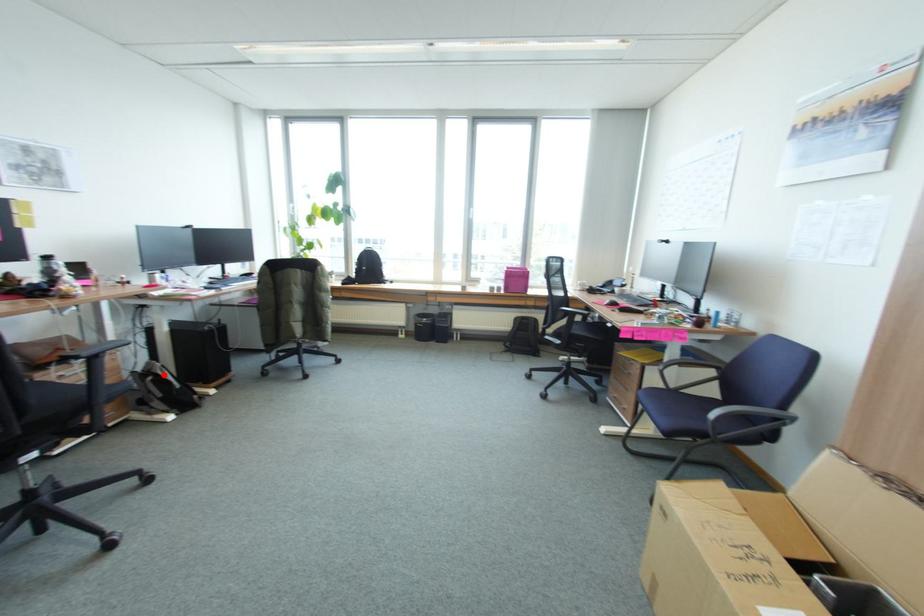
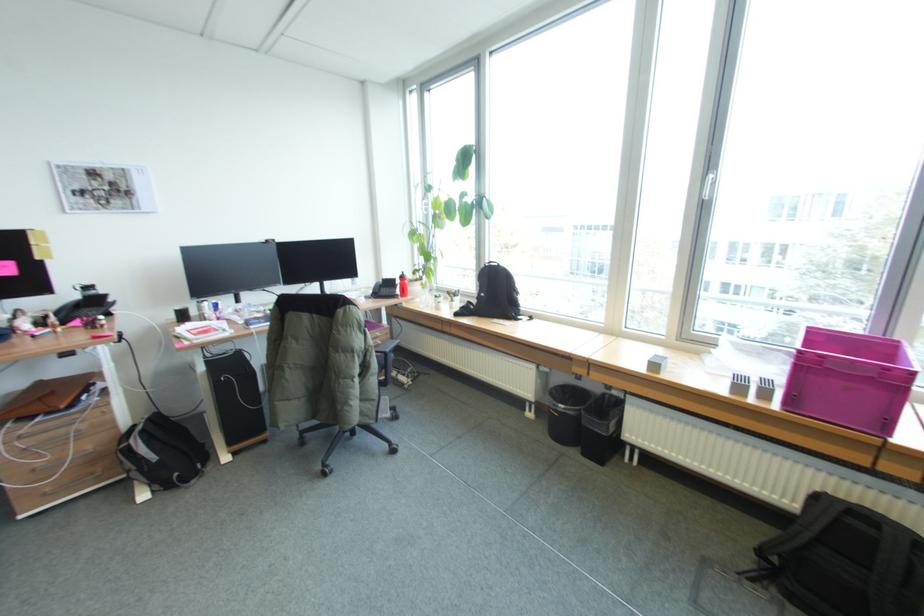
In the second image, find the point that corresponds to the highlighted location in the first image.

(135, 444)